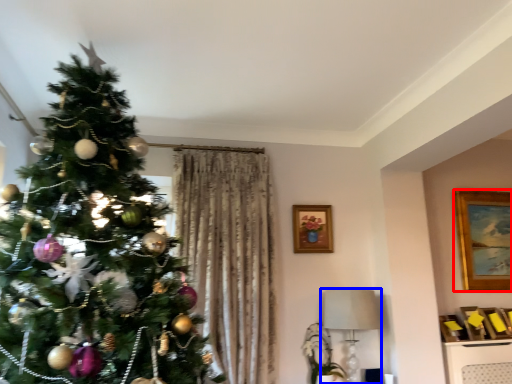
Question: Which point is further to the camera, picture frame (highlighted by a red box) or lamp (highlighted by a blue box)?

Choices:
 (A) picture frame
 (B) lamp

Answer: (A)